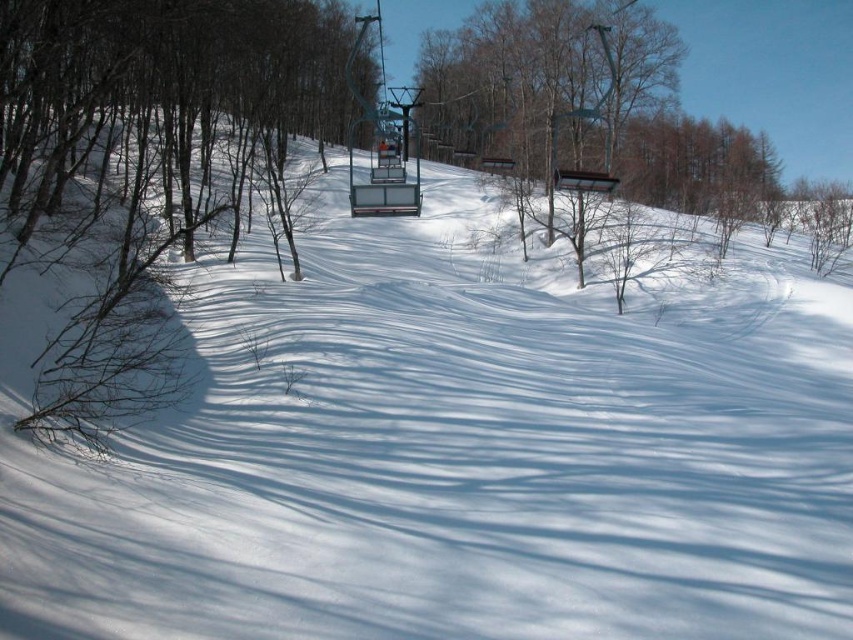
You are standing at the center of the snowfield and see the point marked as (x=148, y=172). Which direction should you walk to reach the brown bark tree at left?

The point (x=148, y=172) marks the location of the brown bark tree at left, so you are already at the tree. No need to walk further.

You are standing at the bottom of the slope and want to take a photo of the brown bark tree at left and the metallic blue ski lift at center. Which object should you focus on first if you want to capture both in the same frame without moving the camera?

The brown bark tree at left is below the metallic blue ski lift at center, so you should focus on the metallic blue ski lift at center first to ensure both are in the frame.